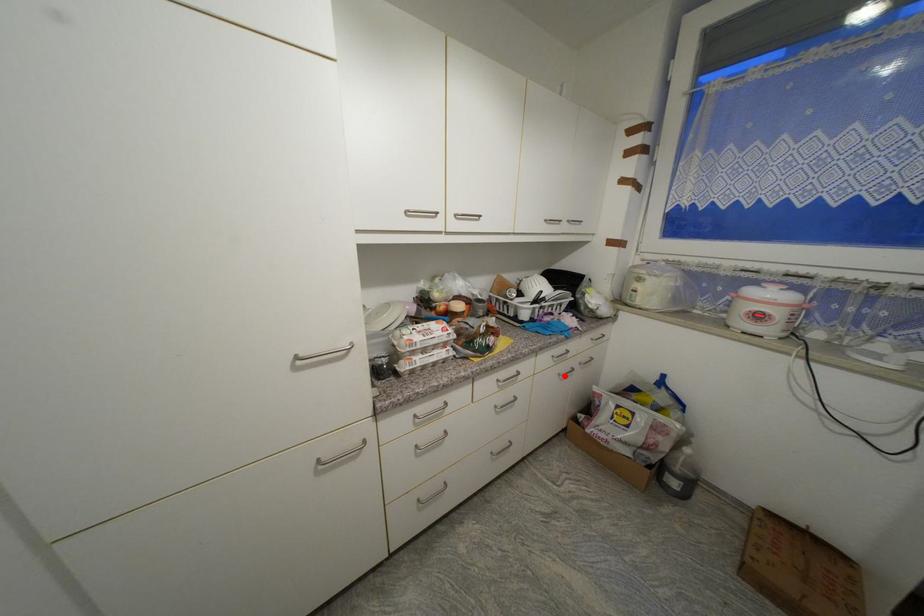
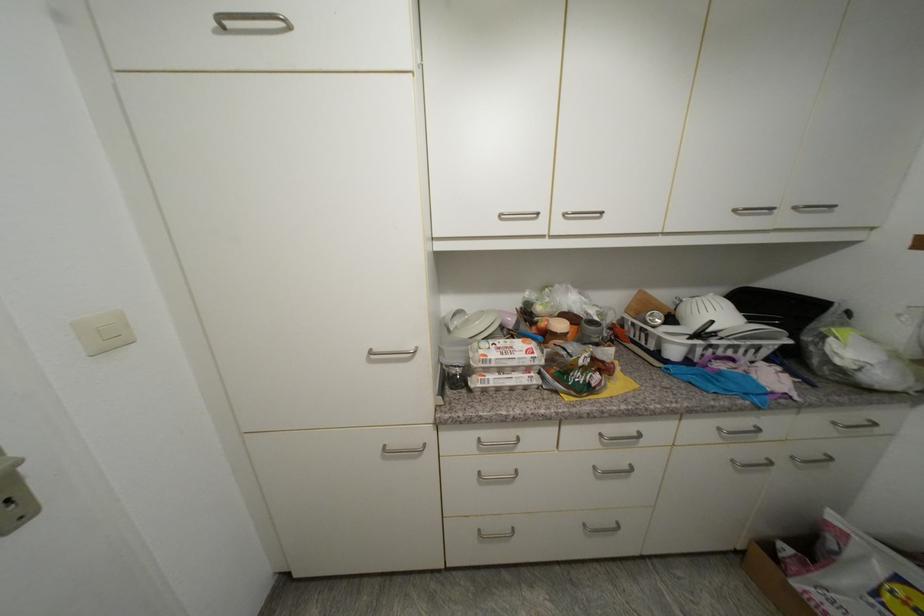
Question: I am providing you with two images of the same scene from different viewpoints. Image1 has a red point marked. In image2, the corresponding 3D location appears at what relative position? Reply with the corresponding letter.

Choices:
 (A) Closer
 (B) Farther

Answer: (A)